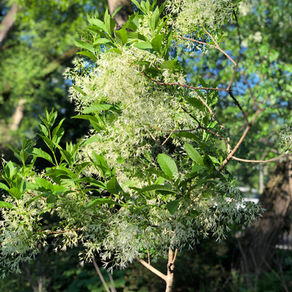
You are a GUI agent. You are given a task and a screenshot of the screen. Output one action in this format:
    pyautogui.click(x=<x>, y=<y>)
    Task: Click on the hood
    Image resolution: width=292 pixels, height=292 pixels.
    Given the screenshot: What is the action you would take?
    pyautogui.click(x=253, y=199)